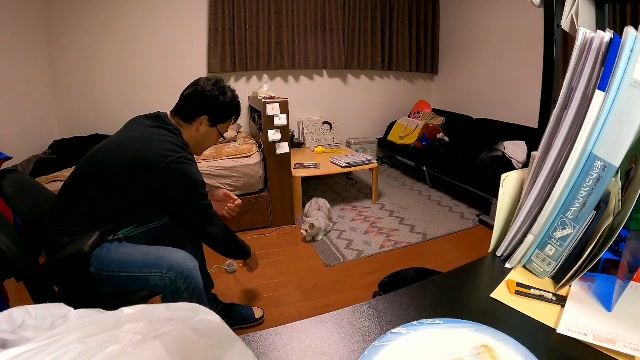
At what (x,y) coordinates should I click in order to perform the action: click on light brown table surface. Please return your answer as a coordinate pair (x, y). Looking at the image, I should click on coord(324,160).